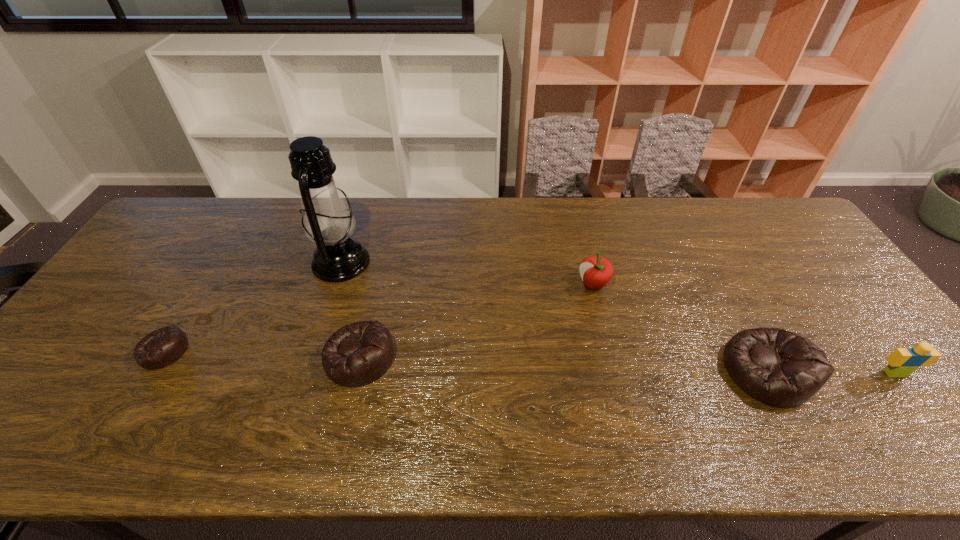
Identify the location of the leftmost object. (160, 348).

You are a GUI agent. You are given a task and a screenshot of the screen. Output one action in this format:
    pyautogui.click(x=<x>, y=<y>)
    Task: Click on the shortest object
    
    Given the screenshot: What is the action you would take?
    pyautogui.click(x=160, y=348)

The width and height of the screenshot is (960, 540). In order to click on the second beanbag from right to left in this screenshot , I will do (357, 354).

I want to click on the second shortest object, so click(x=357, y=354).

Image resolution: width=960 pixels, height=540 pixels. I want to click on the rightmost beanbag, so click(x=779, y=368).

Where is `the tallest object`? This screenshot has width=960, height=540. the tallest object is located at coordinates (328, 221).

Locate an element on the screen. The height and width of the screenshot is (540, 960). apple is located at coordinates (595, 271).

This screenshot has width=960, height=540. Find the location of `Lego`. Lego is located at coordinates (902, 362).

You are a GUI agent. You are given a task and a screenshot of the screen. Output one action in this format:
    pyautogui.click(x=<x>, y=<y>)
    Task: Click on the vacant position located 0.050m on the front of the shortest beanbag
    The width and height of the screenshot is (960, 540).
    Given the screenshot: What is the action you would take?
    (141, 389)

I want to click on vacant space located 0.330m on the left of the second beanbag from left to right, so (x=193, y=357).